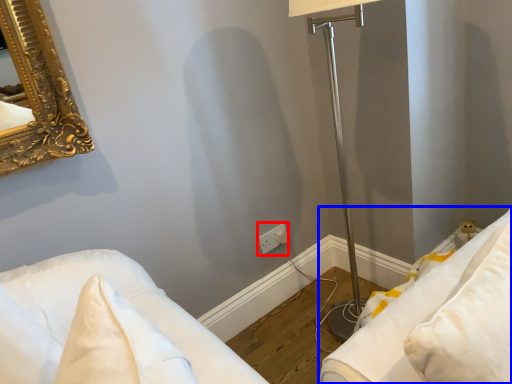
Question: Which object appears closest to the camera in this image, electric outlet (highlighted by a red box) or furniture (highlighted by a blue box)?

Choices:
 (A) electric outlet
 (B) furniture

Answer: (B)